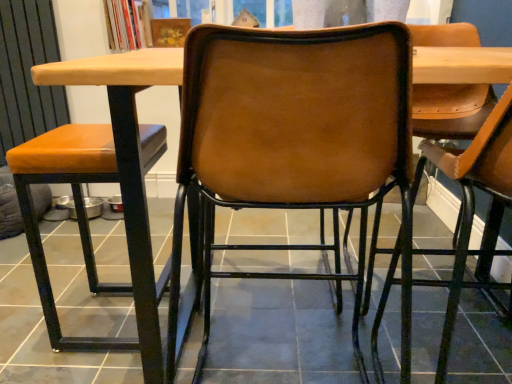
The image size is (512, 384). I want to click on empty space that is ontop of matte brown tile at center, so click(x=211, y=298).